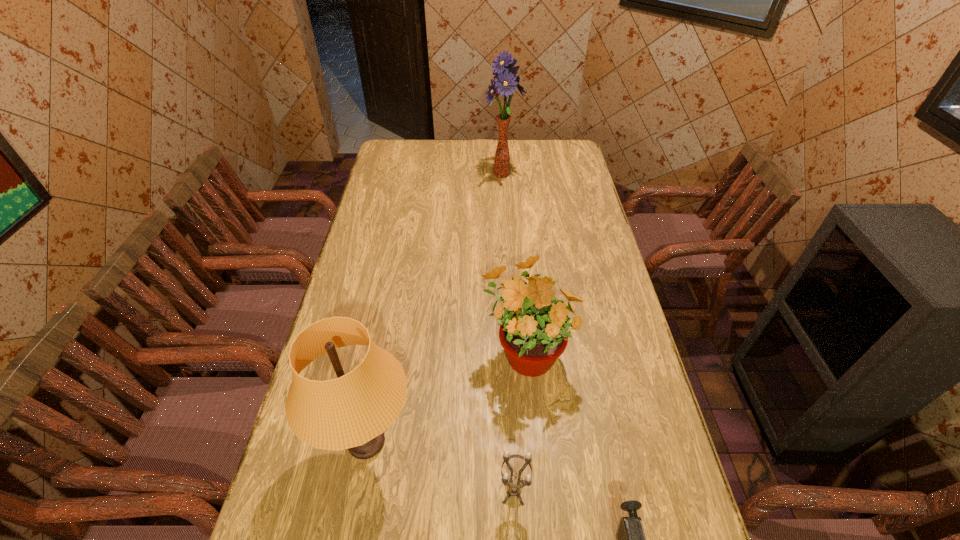
Identify the location of empty location between the leftmost object and the third shortest object. (446, 396).

This screenshot has width=960, height=540. Find the location of `the closest object to the nearest object`. the closest object to the nearest object is located at coordinates (514, 489).

Where is `object identified as the third closest to the rightmost object`? The image size is (960, 540). object identified as the third closest to the rightmost object is located at coordinates (351, 412).

Where is `blank area in the image that satisfies the following two spatial constraints: 1. on the back side of the tallest object; 2. on the right side of the lampshade`? This screenshot has height=540, width=960. blank area in the image that satisfies the following two spatial constraints: 1. on the back side of the tallest object; 2. on the right side of the lampshade is located at coordinates (417, 174).